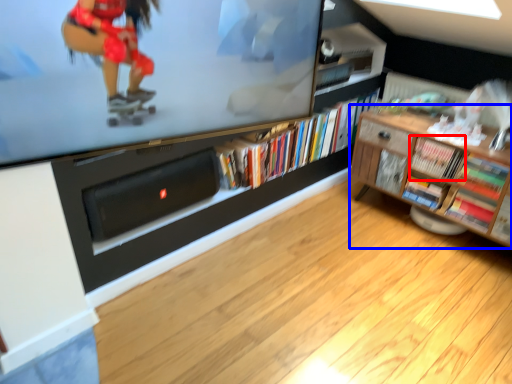
Question: Among these objects, which one is nearest to the camera, book (highlighted by a red box) or shelf (highlighted by a blue box)?

Choices:
 (A) book
 (B) shelf

Answer: (B)